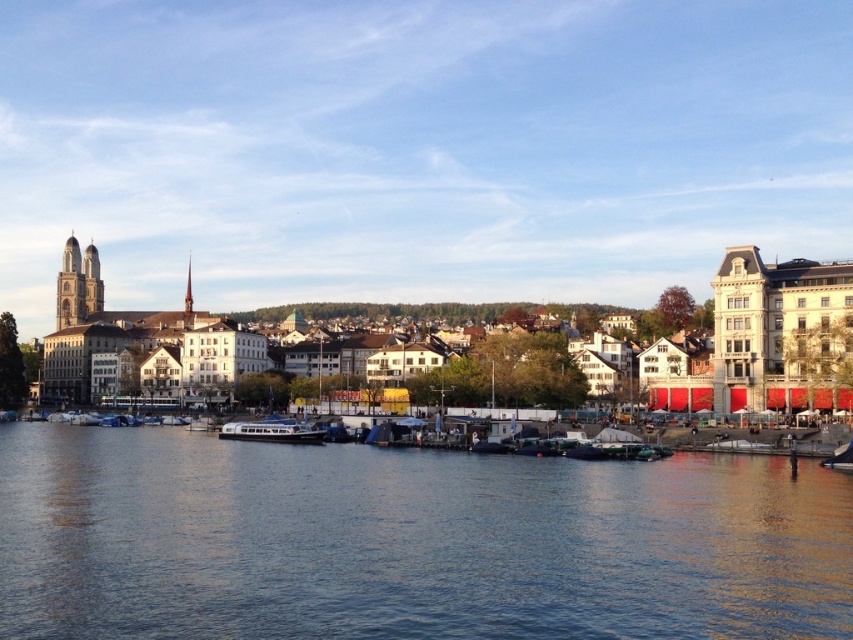
Between blue water at center and white matte building at left, which one is positioned lower?

Positioned lower is blue water at center.

Is blue water at center above white matte building at left?

No, blue water at center is not above white matte building at left.

Which is behind, point (250, 545) or point (828, 296)?

Point (828, 296)

Find the location of a particular element. Image resolution: width=853 pixels, height=640 pixels. blue water at center is located at coordinates (408, 541).

Based on the photo, does blue water at center have a larger size compared to blue metallic boat at center?

Yes, blue water at center is bigger than blue metallic boat at center.

Does blue water at center have a greater height compared to blue metallic boat at center?

Yes, blue water at center is taller than blue metallic boat at center.

Is point (827, 593) positioned in front of point (225, 428)?

Yes, it is.

Image resolution: width=853 pixels, height=640 pixels. What are the coordinates of `blue water at center` in the screenshot? It's located at (408, 541).

Does white matte building at left have a lesser height compared to blue metallic boat at center?

No.

In the scene shown: Does white matte building at left appear over blue metallic boat at center?

Yes, white matte building at left is above blue metallic boat at center.

What do you see at coordinates (780, 332) in the screenshot? The width and height of the screenshot is (853, 640). I see `white matte building at left` at bounding box center [780, 332].

At what (x,y) coordinates should I click in order to perform the action: click on white matte building at left. Please return your answer as a coordinate pair (x, y). Looking at the image, I should click on (780, 332).